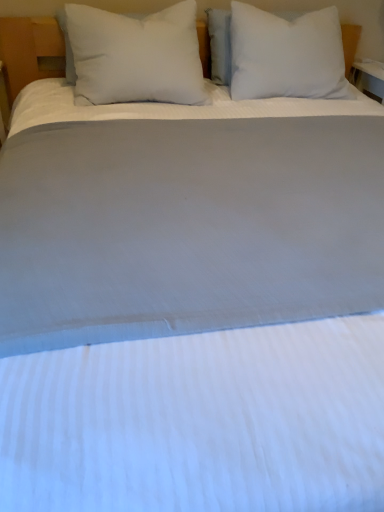
This screenshot has height=512, width=384. In order to click on white soft pillow at upper center, which is counted as the 1th pillow, starting from the right in this screenshot , I will do `click(286, 55)`.

The image size is (384, 512). What do you see at coordinates (286, 55) in the screenshot? I see `white soft pillow at upper center, which is counted as the 1th pillow, starting from the right` at bounding box center [286, 55].

What is the approximate width of white soft pillow at upper center, which is counted as the 1th pillow, starting from the right?

The width of white soft pillow at upper center, which is counted as the 1th pillow, starting from the right, is 13.23 inches.

Image resolution: width=384 pixels, height=512 pixels. Describe the element at coordinates (136, 56) in the screenshot. I see `white soft pillow at left, the 1th pillow positioned from the left` at that location.

This screenshot has height=512, width=384. Identify the location of white soft pillow at left, the 1th pillow positioned from the left. (136, 56).

Identify the location of white soft pillow at upper center, the second pillow in the left-to-right sequence. (286, 55).

Which object is positioned more to the right, white soft pillow at upper center, which is counted as the 1th pillow, starting from the right, or white soft pillow at left, the 1th pillow positioned from the left?

white soft pillow at upper center, which is counted as the 1th pillow, starting from the right.

Which object is further away from the camera, white soft pillow at upper center, the second pillow in the left-to-right sequence, or white soft pillow at left, acting as the second pillow starting from the right?

white soft pillow at upper center, the second pillow in the left-to-right sequence.

Is point (293, 51) positioned before point (146, 48)?

No, (293, 51) is behind (146, 48).

From the image's perspective, is white soft pillow at upper center, the second pillow in the left-to-right sequence, above white soft pillow at left, acting as the second pillow starting from the right?

Correct, white soft pillow at upper center, the second pillow in the left-to-right sequence, appears higher than white soft pillow at left, acting as the second pillow starting from the right, in the image.

From a real-world perspective, is white soft pillow at upper center, the second pillow in the left-to-right sequence, positioned above or below white soft pillow at left, the 1th pillow positioned from the left?

Clearly, from a real-world perspective, white soft pillow at upper center, the second pillow in the left-to-right sequence, is below white soft pillow at left, the 1th pillow positioned from the left.

Which object is wider, white soft pillow at upper center, the second pillow in the left-to-right sequence, or white soft pillow at left, acting as the second pillow starting from the right?

white soft pillow at left, acting as the second pillow starting from the right, is wider.

Considering the sizes of objects white soft pillow at upper center, which is counted as the 1th pillow, starting from the right, and white soft pillow at left, acting as the second pillow starting from the right, in the image provided, who is shorter, white soft pillow at upper center, which is counted as the 1th pillow, starting from the right, or white soft pillow at left, acting as the second pillow starting from the right,?

With less height is white soft pillow at left, acting as the second pillow starting from the right.

Is white soft pillow at upper center, which is counted as the 1th pillow, starting from the right, bigger or smaller than white soft pillow at left, acting as the second pillow starting from the right?

In the image, white soft pillow at upper center, which is counted as the 1th pillow, starting from the right, appears to be larger than white soft pillow at left, acting as the second pillow starting from the right.

Is white soft pillow at upper center, the second pillow in the left-to-right sequence, not within white soft pillow at left, acting as the second pillow starting from the right?

Yes, white soft pillow at upper center, the second pillow in the left-to-right sequence, is not within white soft pillow at left, acting as the second pillow starting from the right.

Is white soft pillow at upper center, the second pillow in the left-to-right sequence, positioned far away from white soft pillow at left, the 1th pillow positioned from the left?

No, white soft pillow at upper center, the second pillow in the left-to-right sequence, is not far from white soft pillow at left, the 1th pillow positioned from the left.

Is white soft pillow at upper center, the second pillow in the left-to-right sequence, oriented away from white soft pillow at left, the 1th pillow positioned from the left?

No, white soft pillow at left, the 1th pillow positioned from the left, is not at the back of white soft pillow at upper center, the second pillow in the left-to-right sequence.

What's the angular difference between white soft pillow at upper center, the second pillow in the left-to-right sequence, and white soft pillow at left, the 1th pillow positioned from the left,'s facing directions?

They differ by 3.33e-05 degrees in their facing directions.

I want to click on pillow below the white soft pillow at upper center, the second pillow in the left-to-right sequence (from the image's perspective), so click(x=136, y=56).

Which object is positioned more to the left, white soft pillow at left, the 1th pillow positioned from the left, or white soft pillow at upper center, the second pillow in the left-to-right sequence?

From the viewer's perspective, white soft pillow at left, the 1th pillow positioned from the left, appears more on the left side.

Is white soft pillow at left, acting as the second pillow starting from the right, in front of or behind white soft pillow at upper center, which is counted as the 1th pillow, starting from the right, in the image?

white soft pillow at left, acting as the second pillow starting from the right, is positioned closer to the viewer than white soft pillow at upper center, which is counted as the 1th pillow, starting from the right.

Considering the points (92, 29) and (274, 94), which point is in front, point (92, 29) or point (274, 94)?

The point (92, 29) is closer to the camera.

From the image's perspective, is white soft pillow at left, acting as the second pillow starting from the right, under white soft pillow at upper center, which is counted as the 1th pillow, starting from the right?

Correct, white soft pillow at left, acting as the second pillow starting from the right, appears lower than white soft pillow at upper center, which is counted as the 1th pillow, starting from the right, in the image.

From a real-world perspective, which is physically above, white soft pillow at left, the 1th pillow positioned from the left, or white soft pillow at upper center, the second pillow in the left-to-right sequence?

In real-world perspective, white soft pillow at left, the 1th pillow positioned from the left, is above.

In terms of width, does white soft pillow at left, the 1th pillow positioned from the left, look wider or thinner when compared to white soft pillow at upper center, the second pillow in the left-to-right sequence?

In the image, white soft pillow at left, the 1th pillow positioned from the left, appears to be wider than white soft pillow at upper center, the second pillow in the left-to-right sequence.

Considering the relative sizes of white soft pillow at left, the 1th pillow positioned from the left, and white soft pillow at upper center, which is counted as the 1th pillow, starting from the right, in the image provided, is white soft pillow at left, the 1th pillow positioned from the left, shorter than white soft pillow at upper center, which is counted as the 1th pillow, starting from the right,?

Indeed, white soft pillow at left, the 1th pillow positioned from the left, has a lesser height compared to white soft pillow at upper center, which is counted as the 1th pillow, starting from the right.

Is white soft pillow at left, acting as the second pillow starting from the right, bigger than white soft pillow at upper center, which is counted as the 1th pillow, starting from the right?

No, white soft pillow at left, acting as the second pillow starting from the right, is not bigger than white soft pillow at upper center, which is counted as the 1th pillow, starting from the right.

Is white soft pillow at upper center, the second pillow in the left-to-right sequence, inside white soft pillow at left, acting as the second pillow starting from the right?

No, white soft pillow at upper center, the second pillow in the left-to-right sequence, is not surrounded by white soft pillow at left, acting as the second pillow starting from the right.

Is white soft pillow at left, acting as the second pillow starting from the right, in contact with white soft pillow at upper center, the second pillow in the left-to-right sequence?

No, white soft pillow at left, acting as the second pillow starting from the right, is not with white soft pillow at upper center, the second pillow in the left-to-right sequence.

Is white soft pillow at left, acting as the second pillow starting from the right, facing away from white soft pillow at upper center, the second pillow in the left-to-right sequence?

No, white soft pillow at left, acting as the second pillow starting from the right,'s orientation is not away from white soft pillow at upper center, the second pillow in the left-to-right sequence.

In the scene shown: How many degrees apart are the facing directions of white soft pillow at left, the 1th pillow positioned from the left, and white soft pillow at upper center, which is counted as the 1th pillow, starting from the right?

The facing directions of white soft pillow at left, the 1th pillow positioned from the left, and white soft pillow at upper center, which is counted as the 1th pillow, starting from the right, are 3.33e-05 degrees apart.

How distant is white soft pillow at left, acting as the second pillow starting from the right, from white soft pillow at upper center, which is counted as the 1th pillow, starting from the right?

white soft pillow at left, acting as the second pillow starting from the right, is 41.37 centimeters away from white soft pillow at upper center, which is counted as the 1th pillow, starting from the right.

Find the location of a particular element. Image resolution: width=384 pixels, height=512 pixels. pillow behind the white soft pillow at left, the 1th pillow positioned from the left is located at coordinates (286, 55).

The height and width of the screenshot is (512, 384). I want to click on pillow below the white soft pillow at left, acting as the second pillow starting from the right (from a real-world perspective), so click(286, 55).

Identify the location of pillow that appears behind the white soft pillow at left, the 1th pillow positioned from the left. (286, 55).